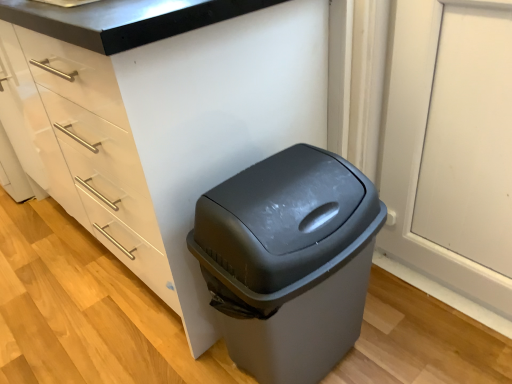
What do you see at coordinates (289, 260) in the screenshot? Image resolution: width=512 pixels, height=384 pixels. I see `gray plastic trash can at center` at bounding box center [289, 260].

In order to face gray plastic trash can at center, should I rotate leftwards or rightwards?

Rotate your view right by about 5.982°.

This screenshot has height=384, width=512. In order to click on gray plastic trash can at center in this screenshot , I will do `click(289, 260)`.

Describe the element at coordinates (158, 116) in the screenshot. Image resolution: width=512 pixels, height=384 pixels. I see `white glossy cabinet at center` at that location.

This screenshot has height=384, width=512. What are the coordinates of `white glossy cabinet at center` in the screenshot? It's located at (158, 116).

Find the location of `gray plastic trash can at center`. gray plastic trash can at center is located at coordinates (289, 260).

Can you confirm if gray plastic trash can at center is positioned to the left of white glossy cabinet at center?

Incorrect, gray plastic trash can at center is not on the left side of white glossy cabinet at center.

Is gray plastic trash can at center further to camera compared to white glossy cabinet at center?

Yes, gray plastic trash can at center is further from the viewer.

Is point (271, 260) closer to camera compared to point (31, 168)?

Yes, point (271, 260) is closer to viewer.

From the image's perspective, which object appears higher, gray plastic trash can at center or white glossy cabinet at center?

white glossy cabinet at center, from the image's perspective.

From a real-world perspective, between gray plastic trash can at center and white glossy cabinet at center, who is vertically lower?

gray plastic trash can at center, from a real-world perspective.

Considering the sizes of objects gray plastic trash can at center and white glossy cabinet at center in the image provided, who is wider, gray plastic trash can at center or white glossy cabinet at center?

Wider between the two is white glossy cabinet at center.

Considering the relative sizes of gray plastic trash can at center and white glossy cabinet at center in the image provided, is gray plastic trash can at center shorter than white glossy cabinet at center?

Yes, gray plastic trash can at center is shorter than white glossy cabinet at center.

Is gray plastic trash can at center bigger than white glossy cabinet at center?

No.

Based on the photo, can white glossy cabinet at center be found inside gray plastic trash can at center?

No.

Would you consider gray plastic trash can at center to be distant from white glossy cabinet at center?

No, gray plastic trash can at center is not far away from white glossy cabinet at center.

Does gray plastic trash can at center turn towards white glossy cabinet at center?

No, gray plastic trash can at center is not aimed at white glossy cabinet at center.

What's the angular difference between gray plastic trash can at center and white glossy cabinet at center's facing directions?

The angular difference between gray plastic trash can at center and white glossy cabinet at center is 87.4 degrees.

Find the location of a particular element. The height and width of the screenshot is (384, 512). waste container below the white glossy cabinet at center (from a real-world perspective) is located at coordinates [x=289, y=260].

Is white glossy cabinet at center to the right of gray plastic trash can at center from the viewer's perspective?

Incorrect, white glossy cabinet at center is not on the right side of gray plastic trash can at center.

Which is behind, white glossy cabinet at center or gray plastic trash can at center?

gray plastic trash can at center is further from the camera.

Considering the positions of point (67, 64) and point (213, 273), is point (67, 64) closer or farther from the camera than point (213, 273)?

Clearly, point (67, 64) is more distant from the camera than point (213, 273).

From the image's perspective, between white glossy cabinet at center and gray plastic trash can at center, which one is located above?

white glossy cabinet at center, from the image's perspective.

From a real-world perspective, between white glossy cabinet at center and gray plastic trash can at center, who is vertically higher?

In real-world perspective, white glossy cabinet at center is above.

Can you confirm if white glossy cabinet at center is wider than gray plastic trash can at center?

Correct, the width of white glossy cabinet at center exceeds that of gray plastic trash can at center.

Does white glossy cabinet at center have a greater height compared to gray plastic trash can at center?

Correct, white glossy cabinet at center is much taller as gray plastic trash can at center.

Who is bigger, white glossy cabinet at center or gray plastic trash can at center?

Bigger between the two is white glossy cabinet at center.

Is white glossy cabinet at center not inside gray plastic trash can at center?

Yes, white glossy cabinet at center is located beyond the bounds of gray plastic trash can at center.

Does white glossy cabinet at center touch gray plastic trash can at center?

white glossy cabinet at center is not next to gray plastic trash can at center, and they're not touching.

Does white glossy cabinet at center turn towards gray plastic trash can at center?

No, white glossy cabinet at center is not oriented towards gray plastic trash can at center.

Locate an element on the screen. Image resolution: width=512 pixels, height=384 pixels. cabinetry above the gray plastic trash can at center (from the image's perspective) is located at coordinates (158, 116).

At what (x,y) coordinates should I click in order to perform the action: click on cabinetry that appears above the gray plastic trash can at center (from a real-world perspective). Please return your answer as a coordinate pair (x, y). This screenshot has height=384, width=512. Looking at the image, I should click on (158, 116).

Locate an element on the screen. Image resolution: width=512 pixels, height=384 pixels. waste container on the right of white glossy cabinet at center is located at coordinates (289, 260).